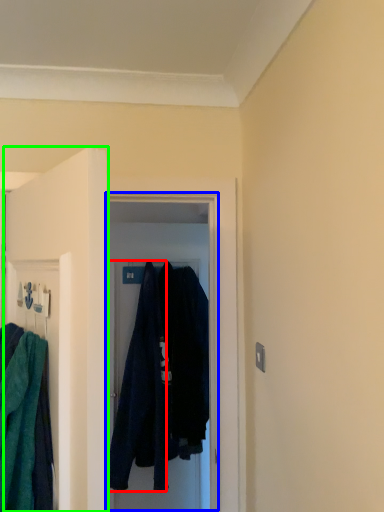
Question: Which object is positioned farthest from robe (highlighted by a red box)? Select from glass door (highlighted by a blue box) and door (highlighted by a green box).

Choices:
 (A) glass door
 (B) door

Answer: (B)